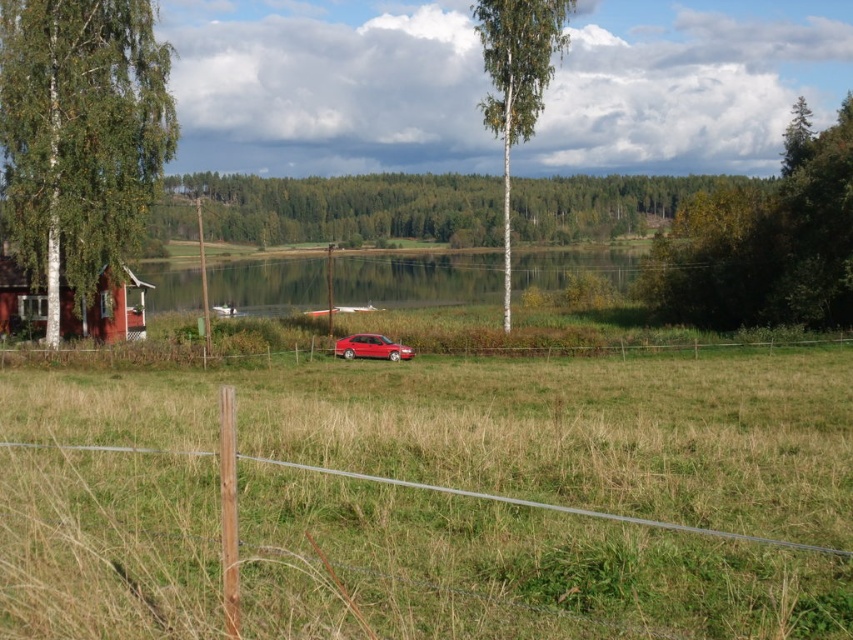
Is clear water at center bigger than shiny red sedan at center?

Yes.

Who is positioned more to the left, clear water at center or shiny red sedan at center?

shiny red sedan at center

Looking at this image, measure the distance between point (550, 276) and camera.

408.86 feet

The width and height of the screenshot is (853, 640). What are the coordinates of `clear water at center` in the screenshot? It's located at (416, 280).

Is matte red wooden hut at left taller than shiny red sedan at center?

Correct, matte red wooden hut at left is much taller as shiny red sedan at center.

Is point (132, 273) behind point (381, 349)?

Yes, it is behind point (381, 349).

You are a GUI agent. You are given a task and a screenshot of the screen. Output one action in this format:
    pyautogui.click(x=<x>, y=<y>)
    Task: Click on the matte red wooden hut at left
    
    Given the screenshot: What is the action you would take?
    pyautogui.click(x=106, y=308)

Is green leafy tree at center to the right of white bark birch tree at center from the viewer's perspective?

Incorrect, green leafy tree at center is not on the right side of white bark birch tree at center.

From the picture: Can you confirm if green leafy tree at center is taller than white bark birch tree at center?

No.

Is point (379, 179) behind point (495, 60)?

That is True.

Locate an element on the screen. This screenshot has width=853, height=640. green leafy tree at center is located at coordinates (334, 209).